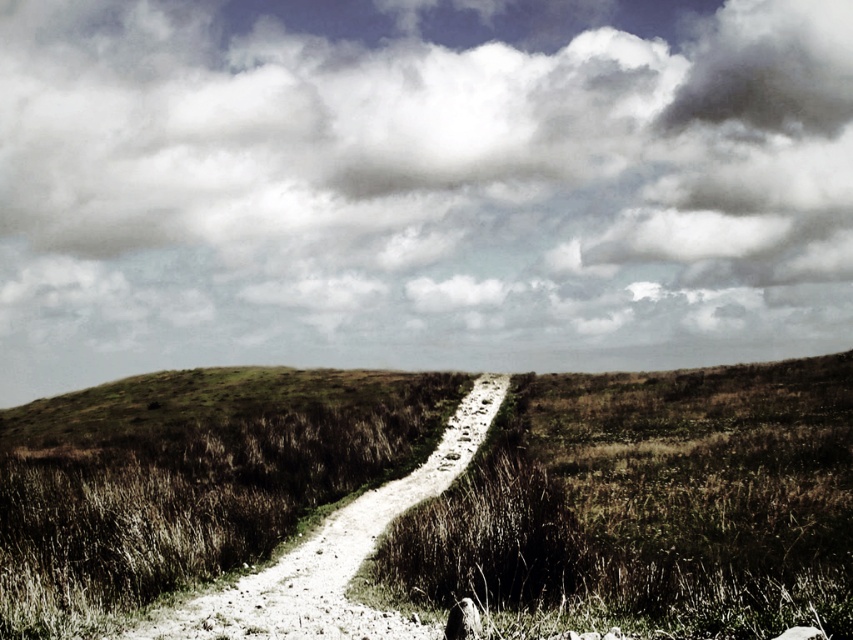
Is cloudy sky at upper center bigger than white gravel trail at center?

Correct, cloudy sky at upper center is larger in size than white gravel trail at center.

In the scene shown: Who is lower down, cloudy sky at upper center or white gravel trail at center?

white gravel trail at center is lower down.

Is point (675, 88) farther from camera compared to point (404, 620)?

Yes.

You are a GUI agent. You are given a task and a screenshot of the screen. Output one action in this format:
    pyautogui.click(x=<x>, y=<y>)
    Task: Click on the cloudy sky at upper center
    
    Given the screenshot: What is the action you would take?
    pyautogui.click(x=421, y=186)